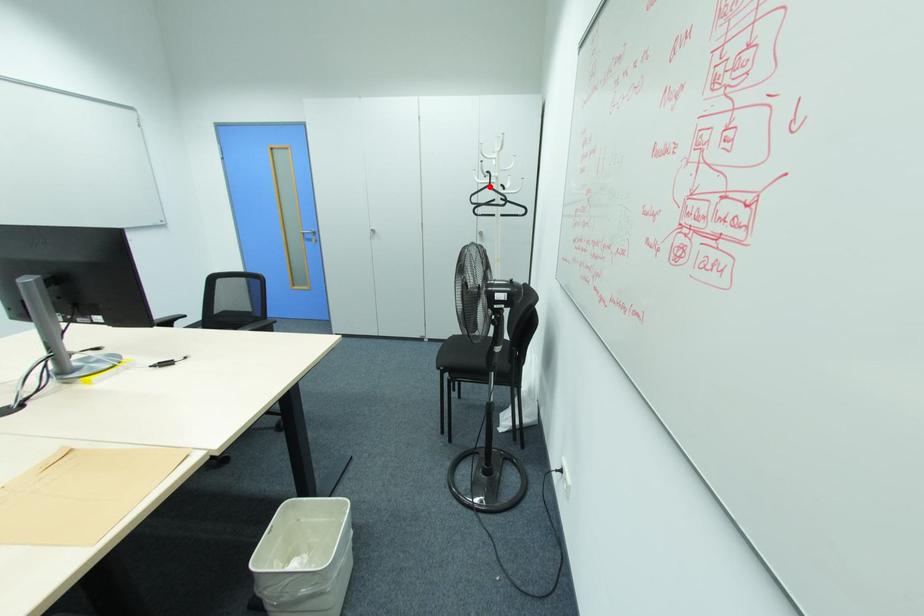
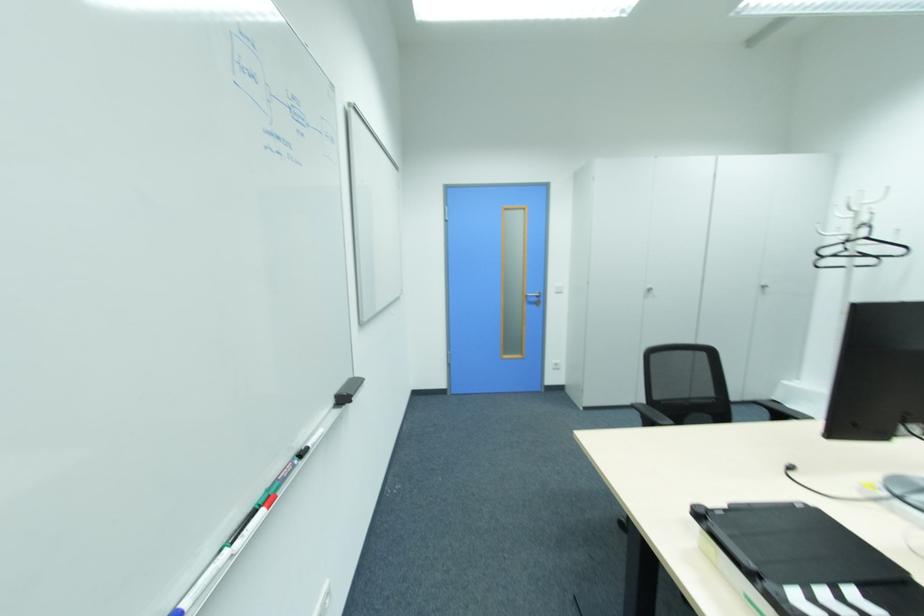
Question: I am providing you with two images of the same scene from different viewpoints. Image1 has a red point marked. In image2, the corresponding 3D location appears at what relative position? Reply with the corresponding letter.

Choices:
 (A) Closer
 (B) Farther

Answer: (B)